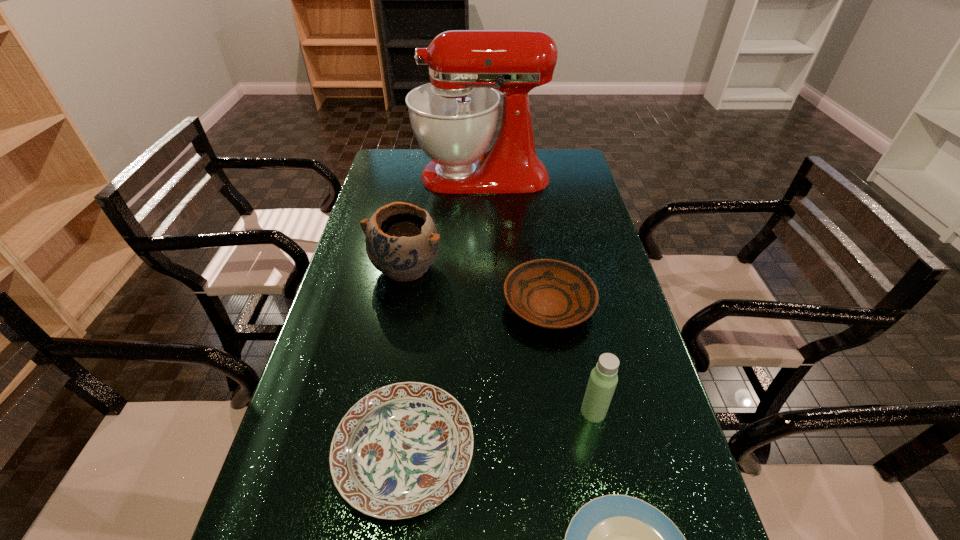
This screenshot has width=960, height=540. Find the location of `vacant area situated 0.130m at the attachment hub of the mixer`. vacant area situated 0.130m at the attachment hub of the mixer is located at coordinates (381, 176).

At what (x,y) coordinates should I click in order to perform the action: click on vacant space located 0.250m on the right of the pottery. Please return your answer as a coordinate pair (x, y). The width and height of the screenshot is (960, 540). Looking at the image, I should click on (526, 268).

This screenshot has height=540, width=960. Find the location of `vacant area situated on the front of the thermos bottle`. vacant area situated on the front of the thermos bottle is located at coordinates (611, 493).

You are a GUI agent. You are given a task and a screenshot of the screen. Output one action in this format:
    pyautogui.click(x=<x>, y=<y>)
    Task: Click on the free region located on the left of the tallest plate
    This screenshot has height=540, width=960.
    Given the screenshot: What is the action you would take?
    pyautogui.click(x=464, y=305)

This screenshot has width=960, height=540. In order to click on vacant space located 0.270m on the right of the fifth tallest object in this screenshot , I will do `click(603, 454)`.

Find the location of a particular element. Image resolution: width=960 pixels, height=540 pixels. object that is positioned at the far edge is located at coordinates (454, 117).

Identify the location of mixer that is at the left edge. The height and width of the screenshot is (540, 960). (454, 117).

Where is `pottery at the left edge`? The height and width of the screenshot is (540, 960). pottery at the left edge is located at coordinates (402, 241).

At what (x,y) coordinates should I click in order to perform the action: click on plate located in the left edge section of the desktop. Please return your answer as a coordinate pair (x, y). The image size is (960, 540). Looking at the image, I should click on (400, 451).

At what (x,y) coordinates should I click in order to perform the action: click on mixer at the right edge. Please return your answer as a coordinate pair (x, y). The height and width of the screenshot is (540, 960). Looking at the image, I should click on point(454,117).